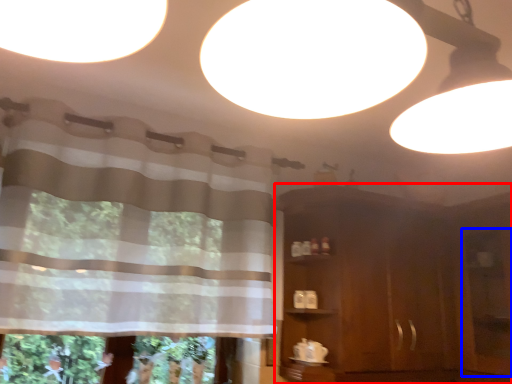
Question: Which object is closer to the camera taking this photo, dresser (highlighted by a red box) or screen door (highlighted by a blue box)?

Choices:
 (A) dresser
 (B) screen door

Answer: (B)